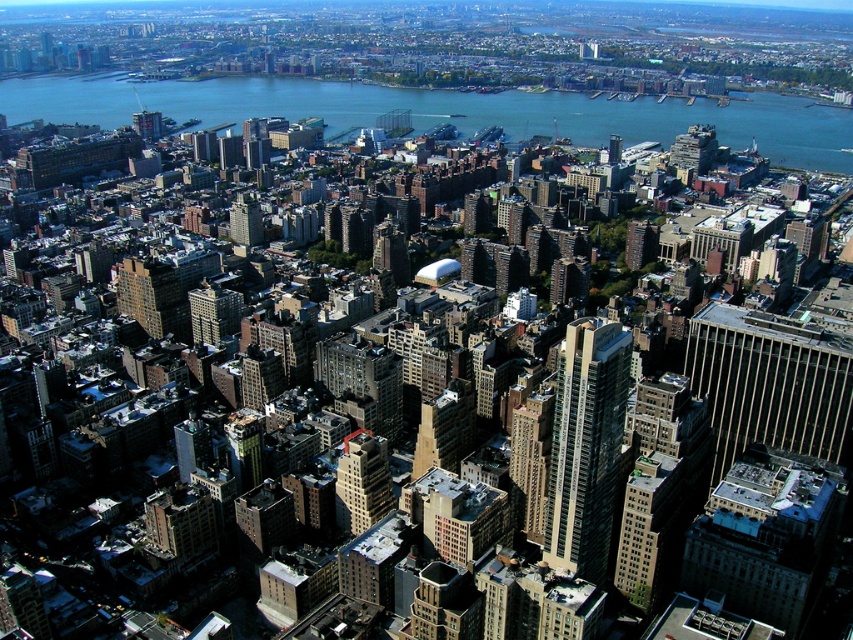
You are standing at the center of the plaza and looking towards the gold glass skyscraper at right and the brown brick building at center. Which building is positioned to your left?

The brown brick building at center is positioned to your left because the gold glass skyscraper at right is to the right of the brown brick building at center.